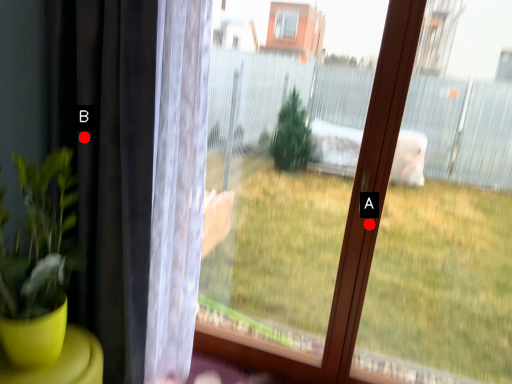
Question: Two points are circled on the image, labeled by A and B beside each circle. Which point is closer to the camera?

Choices:
 (A) A is closer
 (B) B is closer

Answer: (B)